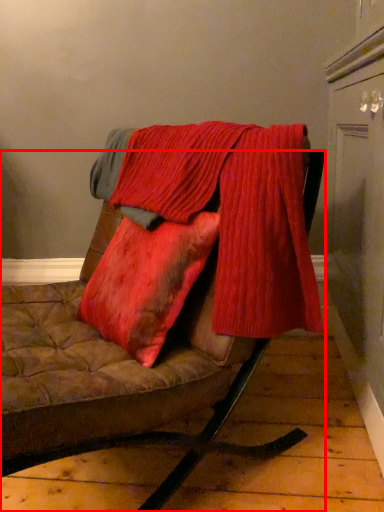
Question: From the image's perspective, where is furniture (annotated by the red box) located relative to laundry?

Choices:
 (A) above
 (B) below

Answer: (B)